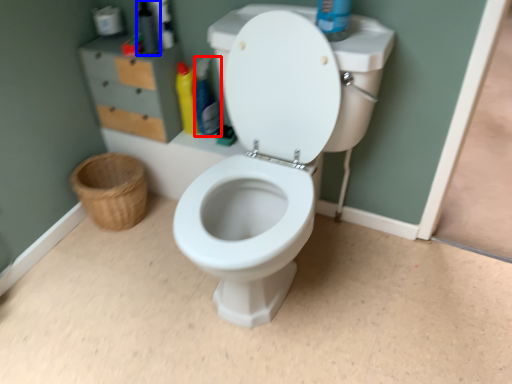
Question: Which point is closer to the camera, cleaning product (highlighted by a red box) or toiletry (highlighted by a blue box)?

Choices:
 (A) cleaning product
 (B) toiletry

Answer: (B)